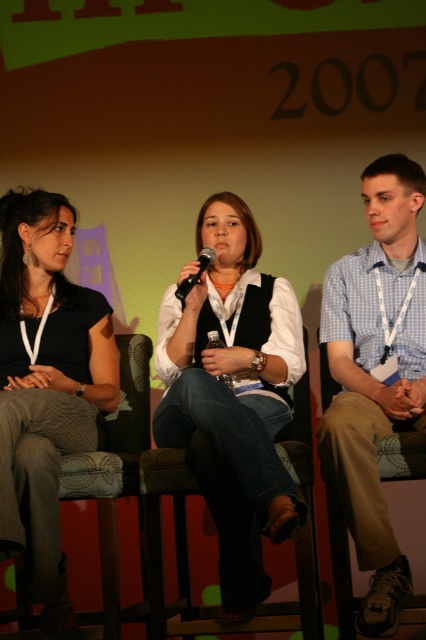
Does blue checkered shirt at center have a smaller size compared to brown fabric chair at center?

Yes, blue checkered shirt at center is smaller than brown fabric chair at center.

Between blue checkered shirt at center and brown fabric chair at center, which one appears on the left side from the viewer's perspective?

brown fabric chair at center

Which is in front, point (371, 333) or point (169, 474)?

Point (169, 474) is more forward.

Identify the location of blue checkered shirt at center. The width and height of the screenshot is (426, 640). (374, 376).

Which is above, matte black top at left or blue checkered shirt at center?

blue checkered shirt at center is above.

Is point (0, 372) positioned behind point (350, 356)?

Yes, it is.

Between point (34, 342) and point (383, 321), which one is positioned in front?

Positioned in front is point (383, 321).

Locate an element on the screen. This screenshot has height=640, width=426. matte black top at left is located at coordinates (46, 384).

The width and height of the screenshot is (426, 640). What do you see at coordinates (46, 384) in the screenshot? I see `matte black top at left` at bounding box center [46, 384].

Who is higher up, matte black top at left or black matte microphone at center?

Positioned higher is black matte microphone at center.

Who is more forward, (17, 484) or (207, 266)?

Point (17, 484) is in front.

Where is `matte black top at left`? This screenshot has width=426, height=640. matte black top at left is located at coordinates (46, 384).